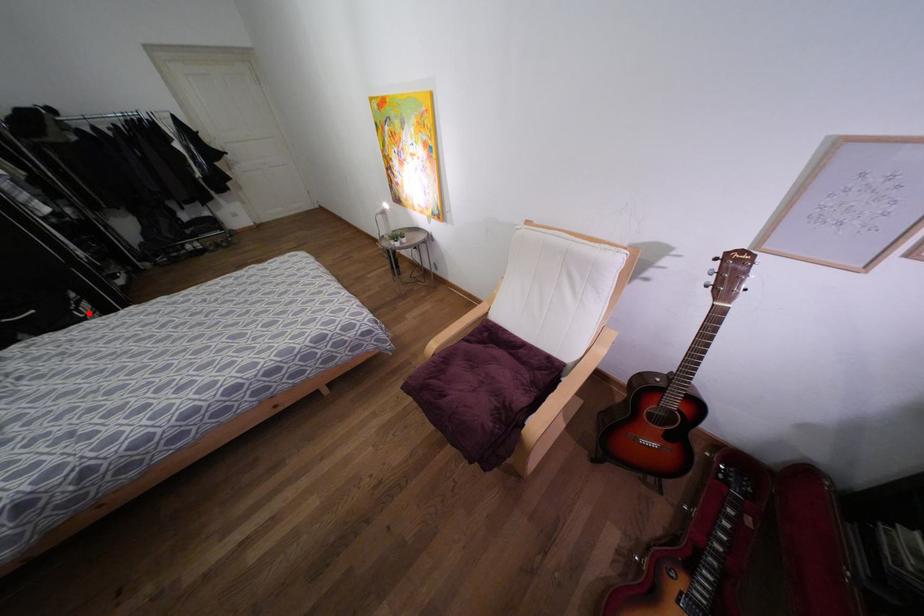
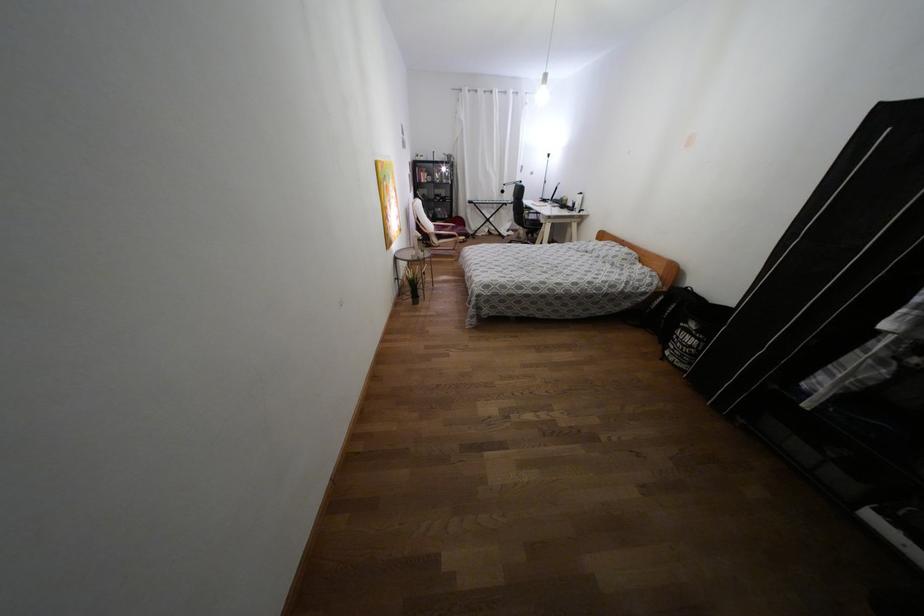
The point at the highlighted location is marked in the first image. Where is the corresponding point in the second image?

(676, 337)